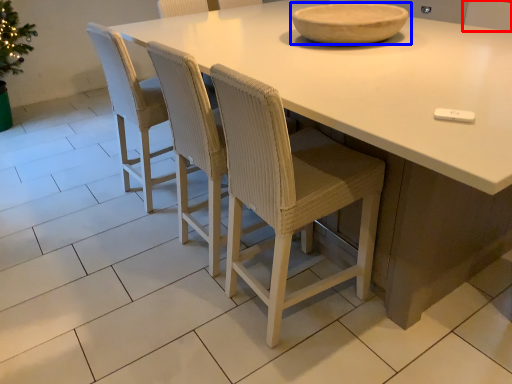
Question: Which object is closer to the camera taking this photo, chair (highlighted by a red box) or bowl (highlighted by a blue box)?

Choices:
 (A) chair
 (B) bowl

Answer: (B)